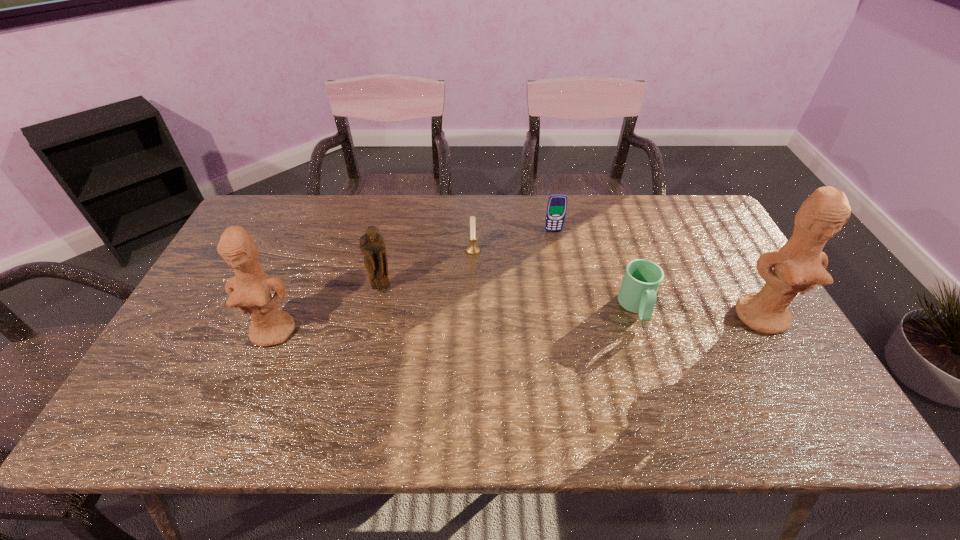
At what (x,y) coordinates should I click in order to perform the action: click on the shortest figurine. Please return your answer as a coordinate pair (x, y). This screenshot has height=540, width=960. Looking at the image, I should click on (372, 245).

The image size is (960, 540). I want to click on vacant region located 0.070m on the front-facing side of the leftmost object, so click(256, 373).

Find the location of `free spot located on the front-facing side of the rightmost figurine`. free spot located on the front-facing side of the rightmost figurine is located at coordinates (794, 371).

Identify the location of free region located 0.240m on the right of the candle holder. Image resolution: width=960 pixels, height=540 pixels. (559, 251).

I want to click on vacant region located 0.310m on the front-facing side of the farthest object, so click(x=567, y=306).

This screenshot has height=540, width=960. Identify the location of vacant space located on the side of the second object from right to left with the handle. (656, 368).

Find the location of a particular element. vacant region located on the front-facing side of the fourth shortest object is located at coordinates (375, 326).

I want to click on object that is at the far edge, so click(557, 203).

Find the location of a particular element. Image resolution: width=960 pixels, height=540 pixels. object situated at the right edge is located at coordinates (799, 265).

In the image, there is a desktop. Where is `vacant space at the far edge`? This screenshot has width=960, height=540. vacant space at the far edge is located at coordinates (420, 198).